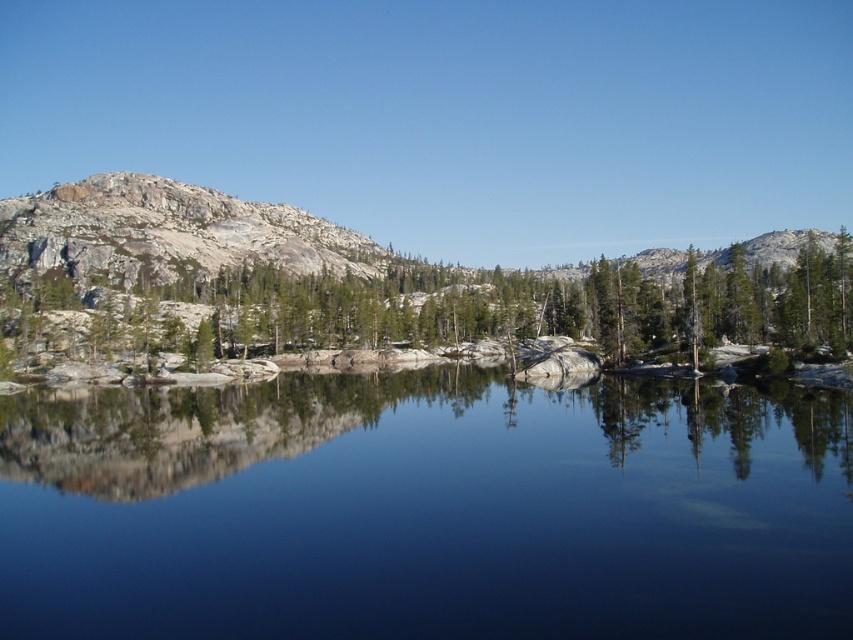
Based on the photo, you are standing on the shore of the lake and see the transparent glass lake at center and the green textured rock at left. Which object is located to the left of the other?

The transparent glass lake at center is positioned on the left side of green textured rock at left, so the transparent glass lake at center is to the left of the green textured rock at left.

What is the exact coordinate of the transparent glass lake at center in the image?

The transparent glass lake at center is located at coordinate point (426, 509).

You are planning to place a small decorative statue on the left side of the lake. The statue requires a base that is wider than the green textured rock at left. Can the granite rock formation at left provide a suitable base for the statue?

The green textured rock at left might be wider than the granite rock formation at left, so it is uncertain if the granite rock formation at left is wide enough to support the statue.